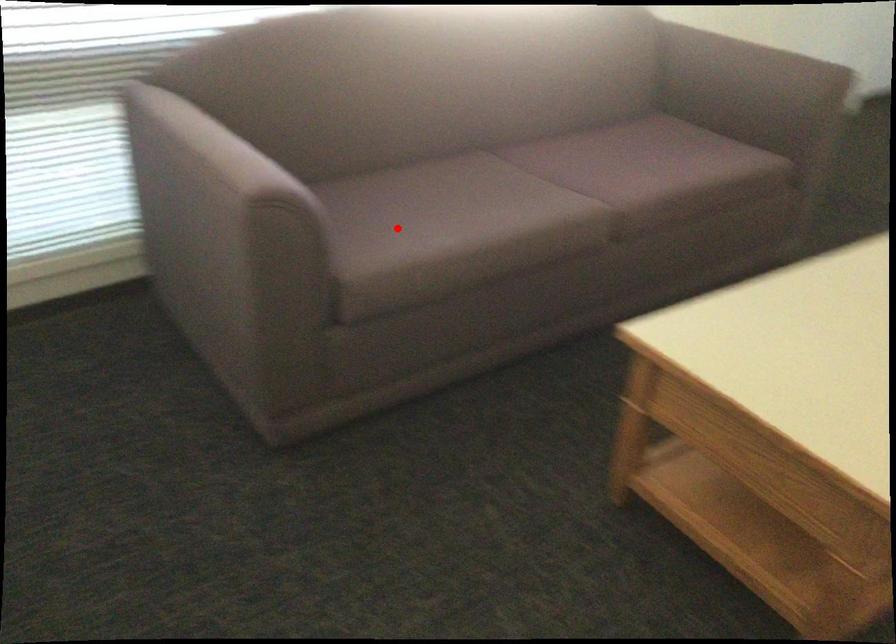
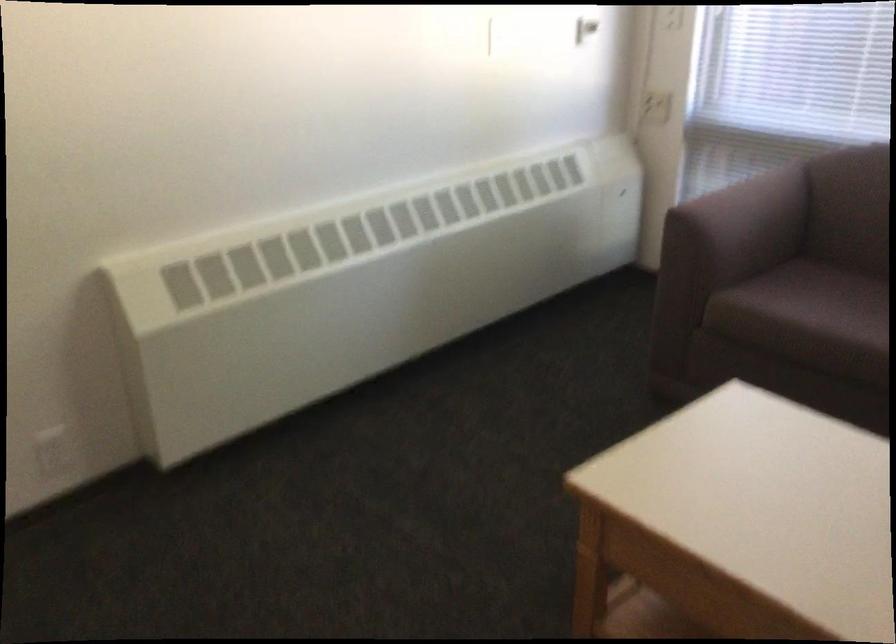
Question: A red point is marked in image1. In image2, is the corresponding 3D point closer to the camera or farther? Reply with the corresponding letter.

Choices:
 (A) The corresponding 3D point is closer.
 (B) The corresponding 3D point is farther.

Answer: (B)